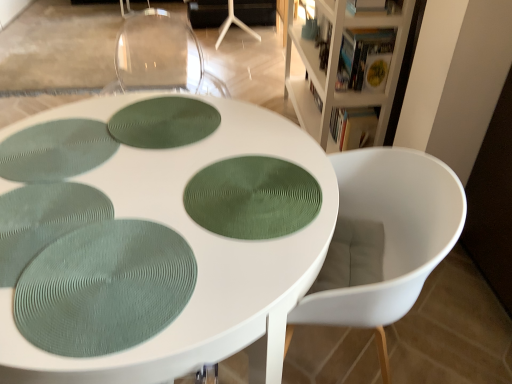
Question: Is the depth of white wood bookcase at upper right greater than that of green textured placemat at lower left, the 3th oval positioned from the top?

Choices:
 (A) no
 (B) yes

Answer: (B)

Question: From a real-world perspective, is white wood bookcase at upper right positioned over green textured placemat at lower left, the 3th oval positioned from the top, based on gravity?

Choices:
 (A) no
 (B) yes

Answer: (A)

Question: Is white wood bookcase at upper right taller than green textured placemat at lower left, marked as the 3th oval in a back-to-front arrangement?

Choices:
 (A) no
 (B) yes

Answer: (B)

Question: From the image's perspective, would you say white wood bookcase at upper right is shown under green textured placemat at lower left, the 3th oval positioned from the top?

Choices:
 (A) yes
 (B) no

Answer: (B)

Question: Is white wood bookcase at upper right to the left of green textured placemat at lower left, marked as the 3th oval in a back-to-front arrangement, from the viewer's perspective?

Choices:
 (A) yes
 (B) no

Answer: (B)

Question: Which is correct: green textured placemat at lower left, the 3th oval positioned from the top, is inside green textured placemat at center, acting as the second oval starting from the back, or outside of it?

Choices:
 (A) inside
 (B) outside

Answer: (B)

Question: From the image's perspective, is green textured placemat at lower left, which is the first oval from front to back, located above or below green textured placemat at center, acting as the 2th oval starting from the front?

Choices:
 (A) above
 (B) below

Answer: (B)

Question: From a real-world perspective, relative to green textured placemat at center, positioned as the second oval in bottom-to-top order, is green textured placemat at lower left, which is the first oval from front to back, vertically above or below?

Choices:
 (A) below
 (B) above

Answer: (B)

Question: Considering the positions of green textured placemat at lower left, the 3th oval positioned from the top, and green textured placemat at center, positioned as the second oval in bottom-to-top order, in the image, is green textured placemat at lower left, the 3th oval positioned from the top, wider or thinner than green textured placemat at center, positioned as the second oval in bottom-to-top order,?

Choices:
 (A) wide
 (B) thin

Answer: (B)

Question: Considering the positions of white wood bookcase at upper right and green textured placemat at center, arranged as the 3th oval when ordered from the bottom, in the image, is white wood bookcase at upper right taller or shorter than green textured placemat at center, arranged as the 3th oval when ordered from the bottom,?

Choices:
 (A) short
 (B) tall

Answer: (B)

Question: Visually, is white wood bookcase at upper right positioned to the left or to the right of green textured placemat at center, which is the 1th oval in back-to-front order?

Choices:
 (A) left
 (B) right

Answer: (B)

Question: From the image's perspective, is white wood bookcase at upper right above or below green textured placemat at center, the 3th oval from the front?

Choices:
 (A) above
 (B) below

Answer: (A)

Question: Based on their sizes in the image, would you say white wood bookcase at upper right is bigger or smaller than green textured placemat at center, arranged as the 3th oval when ordered from the bottom?

Choices:
 (A) small
 (B) big

Answer: (B)

Question: From a real-world perspective, is white wood bookcase at upper right above or below green textured placemat at center, positioned as the second oval in top-to-bottom order?

Choices:
 (A) above
 (B) below

Answer: (B)

Question: In terms of width, does white wood bookcase at upper right look wider or thinner when compared to green textured placemat at center, acting as the second oval starting from the back?

Choices:
 (A) wide
 (B) thin

Answer: (B)